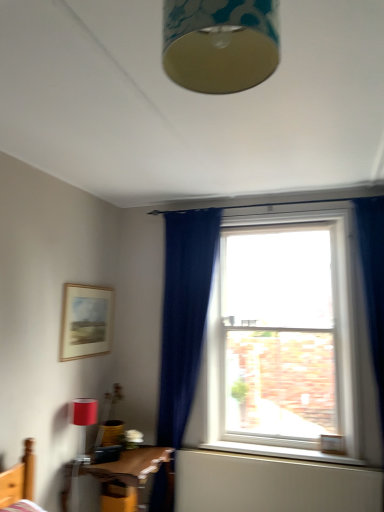
This screenshot has width=384, height=512. Identify the location of free spot above matte wooden picture frame at upper left (from a real-world perspective). (89, 288).